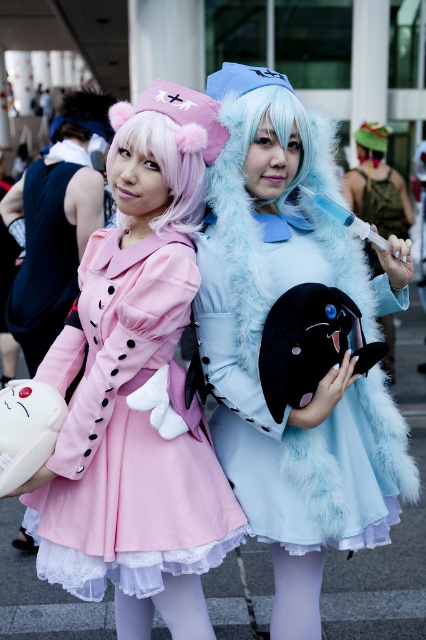
Question: Which object is the closest to the fuzzy blue dress at center?

Choices:
 (A) light blue furry wig at center
 (B) pink fluffy wig at center

Answer: (A)

Question: Estimate the real-world distances between objects in this image. Which object is farther from the pink fluffy wig at center?

Choices:
 (A) light blue furry wig at center
 (B) fuzzy blue dress at center

Answer: (B)

Question: Is matte pink coat at center smaller than fuzzy blue dress at center?

Choices:
 (A) no
 (B) yes

Answer: (A)

Question: Can you confirm if light blue furry wig at center is positioned above pink fluffy wig at center?

Choices:
 (A) no
 (B) yes

Answer: (B)

Question: Based on their relative distances, which object is nearer to the fuzzy blue dress at center?

Choices:
 (A) light blue furry wig at center
 (B) matte pink coat at center
 (C) pink fluffy wig at center

Answer: (B)

Question: Does fuzzy blue dress at center have a lesser width compared to light blue furry wig at center?

Choices:
 (A) no
 (B) yes

Answer: (A)